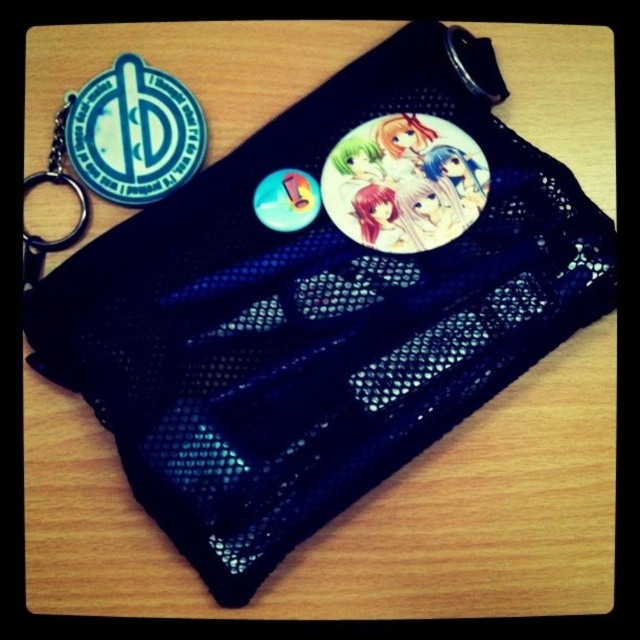
Is point (129, 140) positioned in front of point (288, 220)?

Yes, it is in front of point (288, 220).

Can you confirm if blue rubber badge at upper left is thinner than metallic silver badge at upper left?

Incorrect, blue rubber badge at upper left's width is not less than metallic silver badge at upper left's.

Is point (140, 152) farther from viewer compared to point (269, 218)?

No, it is not.

At what (x,y) coordinates should I click in order to perform the action: click on blue rubber badge at upper left. Please return your answer as a coordinate pair (x, y). The image size is (640, 640). Looking at the image, I should click on (134, 132).